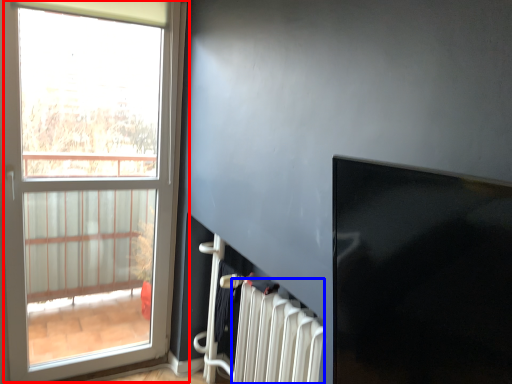
Question: Which of the following is the closest to the observer, window (highlighted by a red box) or radiator (highlighted by a blue box)?

Choices:
 (A) window
 (B) radiator

Answer: (B)